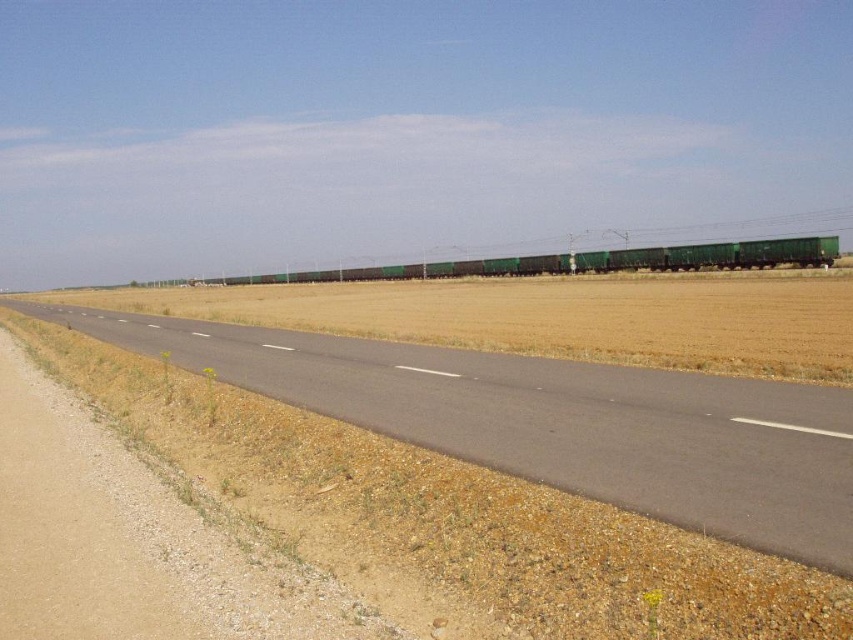
You are a driver approaching an intersection where the asphalt road at center crosses the green matte train carriages at center. The road is narrow. What should you do before proceeding?

The asphalt road at center is thinner than the green matte train carriages at center, so you should stop and check for oncoming trains before proceeding to ensure safety.

Consider the image. You are standing on the paved road and want to cross to the brown grassland at center. Which direction should you walk relative to the green matte train carriages at center?

You should walk to the left of the green matte train carriages at center to reach the brown grassland at center because the brown grassland at center is located to the left of the green matte train carriages at center.

You are standing at the starting point of the road and want to reach the brown grassland at center. Which direction should you walk to get there?

The brown grassland at center is located at point [554,316], so you should walk towards the center of the image to reach it.